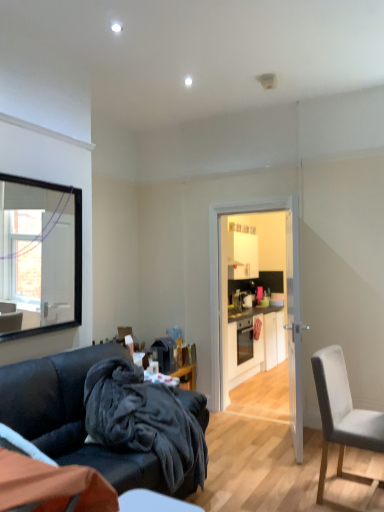
Question: Is the depth of white glossy door at center less than that of velvet dark blue couch at lower left?

Choices:
 (A) yes
 (B) no

Answer: (B)

Question: Is white glossy door at center outside of velvet dark blue couch at lower left?

Choices:
 (A) no
 (B) yes

Answer: (B)

Question: From a real-world perspective, is white glossy door at center on top of velvet dark blue couch at lower left?

Choices:
 (A) yes
 (B) no

Answer: (A)

Question: Is white glossy door at center bigger than velvet dark blue couch at lower left?

Choices:
 (A) no
 (B) yes

Answer: (A)

Question: From the image's perspective, would you say white glossy door at center is shown under velvet dark blue couch at lower left?

Choices:
 (A) yes
 (B) no

Answer: (B)

Question: From a real-world perspective, is light gray fabric chair at right above or below matte black cabinets at center?

Choices:
 (A) above
 (B) below

Answer: (A)

Question: Looking at the image, does light gray fabric chair at right seem bigger or smaller compared to matte black cabinets at center?

Choices:
 (A) big
 (B) small

Answer: (B)

Question: In terms of width, does light gray fabric chair at right look wider or thinner when compared to matte black cabinets at center?

Choices:
 (A) wide
 (B) thin

Answer: (B)

Question: Would you say light gray fabric chair at right is to the left or to the right of matte black cabinets at center in the picture?

Choices:
 (A) left
 (B) right

Answer: (A)

Question: Based on their positions, is matte black cabinets at center located to the left or right of velvet dark blue couch at lower left?

Choices:
 (A) right
 (B) left

Answer: (A)

Question: Considering the positions of matte black cabinets at center and velvet dark blue couch at lower left in the image, is matte black cabinets at center bigger or smaller than velvet dark blue couch at lower left?

Choices:
 (A) small
 (B) big

Answer: (A)

Question: Considering the positions of matte black cabinets at center and velvet dark blue couch at lower left in the image, is matte black cabinets at center wider or thinner than velvet dark blue couch at lower left?

Choices:
 (A) wide
 (B) thin

Answer: (B)

Question: Is point (251, 343) positioned closer to the camera than point (148, 475)?

Choices:
 (A) farther
 (B) closer

Answer: (A)

Question: Is point (288, 348) closer or farther from the camera than point (326, 421)?

Choices:
 (A) closer
 (B) farther

Answer: (B)

Question: Is white glossy door at center inside the boundaries of light gray fabric chair at right, or outside?

Choices:
 (A) outside
 (B) inside

Answer: (A)